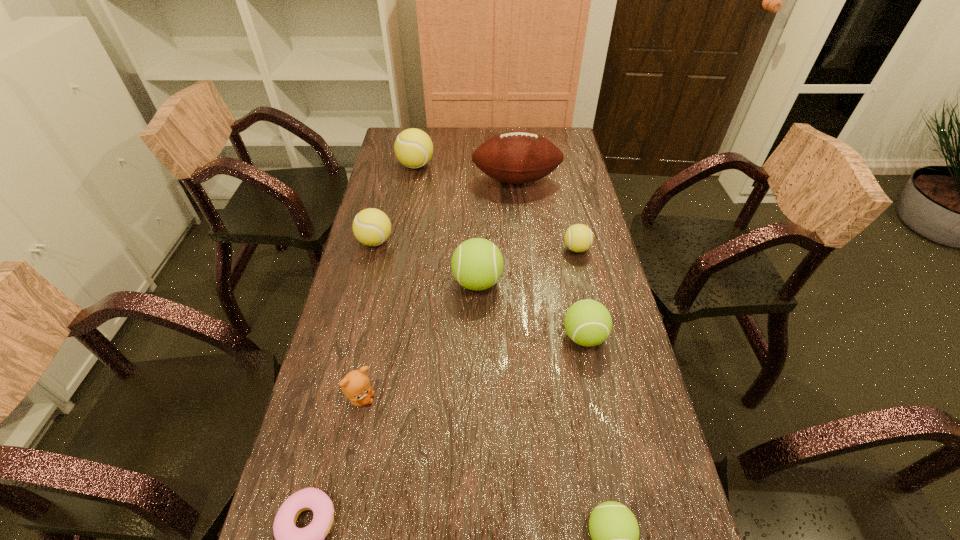
Point out which object is positioned as the sixth nearest to the nearest tennis ball. Please provide its 2D coordinates. Your answer should be formatted as a tuple, i.e. [(x, y)], where the tuple contains the x and y coordinates of a point satisfying the conditions above.

[(372, 227)]

Select which object appears as the closest to the smallest yellow tennis ball. Please provide its 2D coordinates. Your answer should be formatted as a tuple, i.e. [(x, y)], where the tuple contains the x and y coordinates of a point satisfying the conditions above.

[(477, 264)]

Where is `tennis ball that stands as the second closest to the sixth farthest object`? This screenshot has width=960, height=540. tennis ball that stands as the second closest to the sixth farthest object is located at coordinates (578, 238).

Identify the location of the second closest tennis ball relative to the farthest yellow tennis ball. This screenshot has height=540, width=960. (477, 264).

Identify the location of yellow tennis ball that is the nearest to the shortest object. (372, 227).

Choose which yellow tennis ball is the nearest neighbor to the rightmost yellow tennis ball. Please provide its 2D coordinates. Your answer should be formatted as a tuple, i.e. [(x, y)], where the tuple contains the x and y coordinates of a point satisfying the conditions above.

[(372, 227)]

Find the location of a particular element. This screenshot has width=960, height=540. green tennis ball that is the closest to the fifth farthest tennis ball is located at coordinates (477, 264).

The width and height of the screenshot is (960, 540). What are the coordinates of `green tennis ball identified as the closest to the second smallest yellow tennis ball` in the screenshot? It's located at (477, 264).

Identify the location of vacant region that satisfies the following two spatial constraints: 1. on the front side of the farthest green tennis ball; 2. on the right side of the biggest yellow tennis ball. The width and height of the screenshot is (960, 540). (395, 282).

The image size is (960, 540). In order to click on vacant region that satisfies the following two spatial constraints: 1. on the front side of the sixth farthest object; 2. on the left side of the tallest object in this screenshot , I will do `click(532, 337)`.